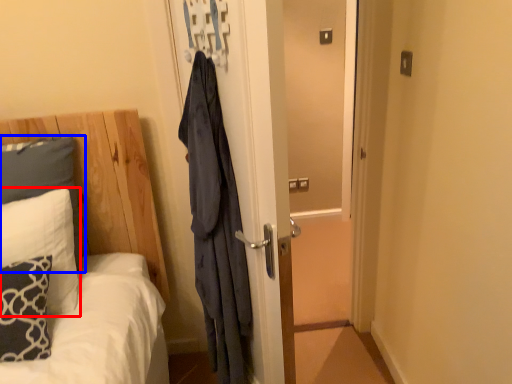
Question: Which object appears closest to the camera in this image, pillow (highlighted by a red box) or pillow (highlighted by a blue box)?

Choices:
 (A) pillow
 (B) pillow

Answer: (A)